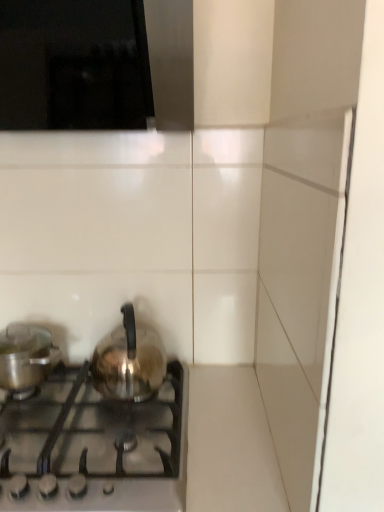
Question: Is shiny metallic kettle at center, the 1th kitchen appliance in the right-to-left sequence, wider than shiny metallic kettle at lower left?

Choices:
 (A) no
 (B) yes

Answer: (A)

Question: Can you confirm if shiny metallic kettle at center, the 2th kitchen appliance when ordered from left to right, is positioned to the left of shiny metallic kettle at lower left?

Choices:
 (A) yes
 (B) no

Answer: (B)

Question: Does shiny metallic kettle at center, the 2th kitchen appliance when ordered from left to right, turn towards shiny metallic kettle at lower left?

Choices:
 (A) yes
 (B) no

Answer: (B)

Question: Does shiny metallic kettle at center, the 2th kitchen appliance when ordered from left to right, contain shiny metallic kettle at lower left?

Choices:
 (A) yes
 (B) no

Answer: (B)

Question: Is shiny metallic kettle at center, the 2th kitchen appliance when ordered from left to right, further to camera compared to shiny metallic kettle at lower left?

Choices:
 (A) yes
 (B) no

Answer: (A)

Question: Is shiny metallic kettle at center, the 1th kitchen appliance in the right-to-left sequence, turned away from shiny metallic kettle at lower left?

Choices:
 (A) no
 (B) yes

Answer: (A)

Question: Is shiny metallic pot at left, the 2th kitchen appliance from the right, touching shiny metallic kettle at lower left?

Choices:
 (A) no
 (B) yes

Answer: (A)

Question: Does shiny metallic pot at left, the first kitchen appliance positioned from the left, have a lesser width compared to shiny metallic kettle at lower left?

Choices:
 (A) yes
 (B) no

Answer: (A)

Question: Is shiny metallic pot at left, the 2th kitchen appliance from the right, to the right of shiny metallic kettle at lower left from the viewer's perspective?

Choices:
 (A) no
 (B) yes

Answer: (A)

Question: Considering the relative sizes of shiny metallic pot at left, the 2th kitchen appliance from the right, and shiny metallic kettle at lower left in the image provided, is shiny metallic pot at left, the 2th kitchen appliance from the right, shorter than shiny metallic kettle at lower left?

Choices:
 (A) yes
 (B) no

Answer: (B)

Question: Is shiny metallic pot at left, the 2th kitchen appliance from the right, facing away from shiny metallic kettle at lower left?

Choices:
 (A) yes
 (B) no

Answer: (B)

Question: Is shiny metallic pot at left, the 2th kitchen appliance from the right, far from shiny metallic kettle at lower left?

Choices:
 (A) no
 (B) yes

Answer: (A)

Question: Can you confirm if shiny metallic kettle at lower left is wider than shiny metallic pot at left, the 2th kitchen appliance from the right?

Choices:
 (A) yes
 (B) no

Answer: (A)